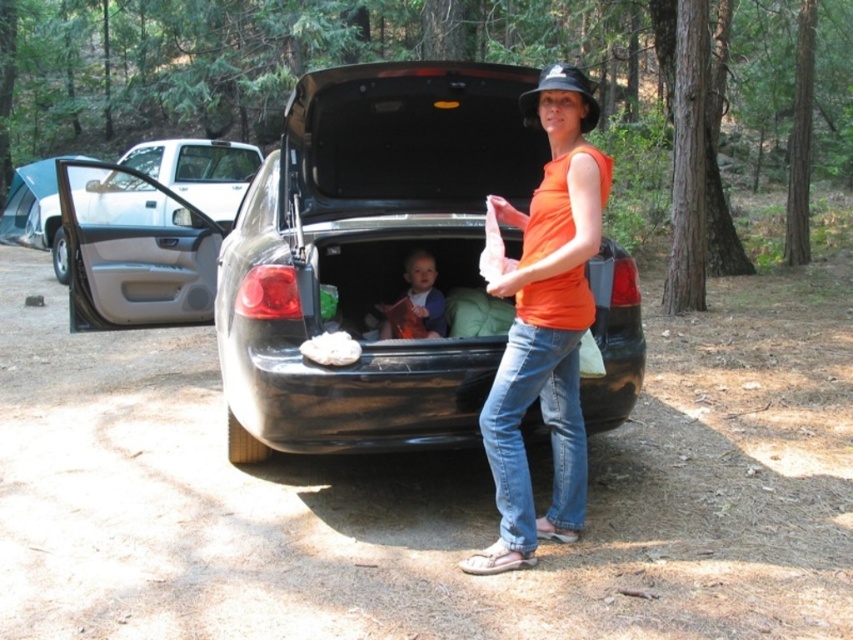
You are a hiker who just arrived at the campsite and see the orange cotton tank top at center and the smooth plastic book at center. Which object is taller?

The orange cotton tank top at center is taller than the smooth plastic book at center.

You are a delivery person who needs to place a package between the shiny black car at center and the smooth plastic book at center. The package requires at least 18 inches of space to be placed safely. Based on the scene, is there enough space between them to place the package?

The distance between the shiny black car at center and the smooth plastic book at center is 16.92 inches, which is less than the required 18 inches. Therefore, there is not enough space to safely place the package between them.